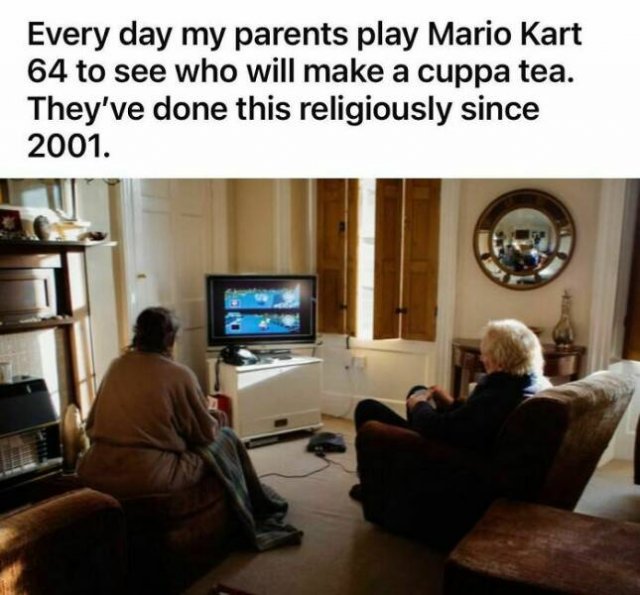
Where is `window shutters`? This screenshot has height=595, width=640. window shutters is located at coordinates (333, 227), (380, 242), (432, 273).